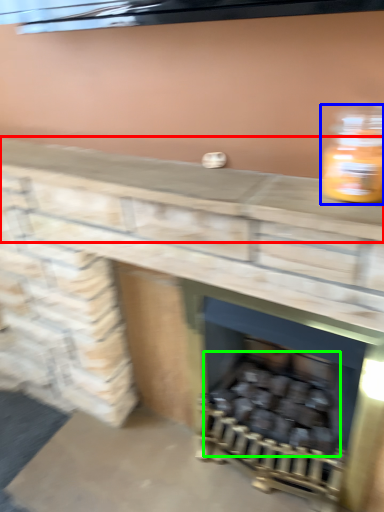
Question: Which is farther away from counter top (highlighted by a red box)? bottle (highlighted by a blue box) or burn (highlighted by a green box)?

Choices:
 (A) bottle
 (B) burn

Answer: (B)